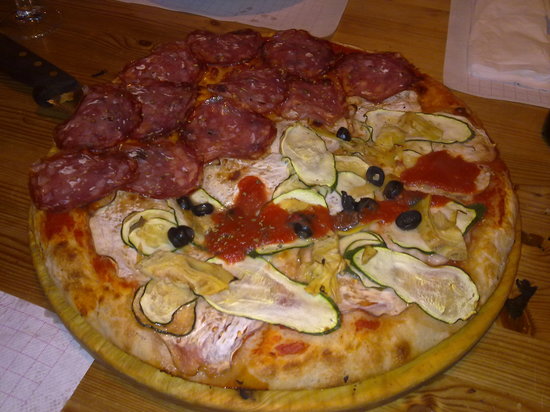
Identify the location of paper mat top left. click(x=262, y=7).